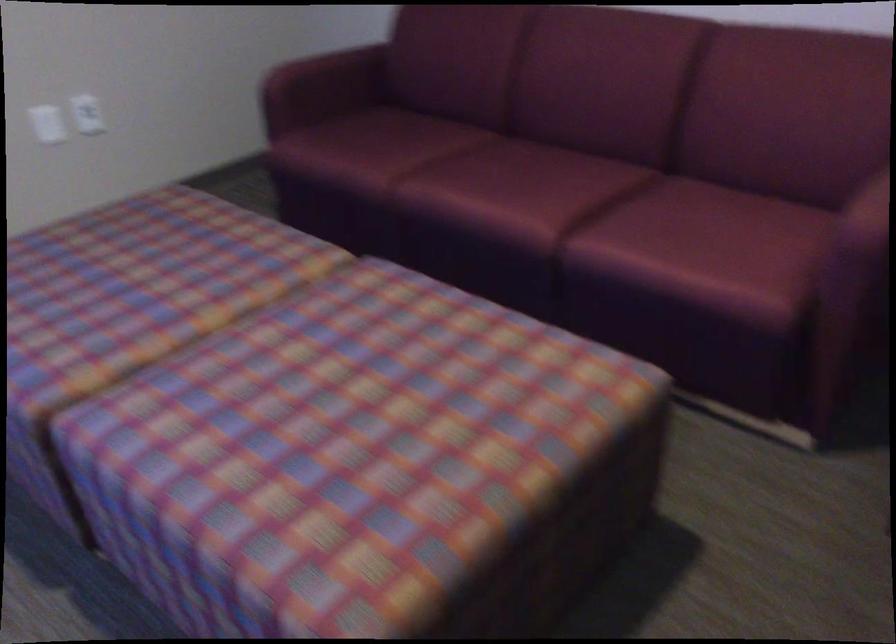
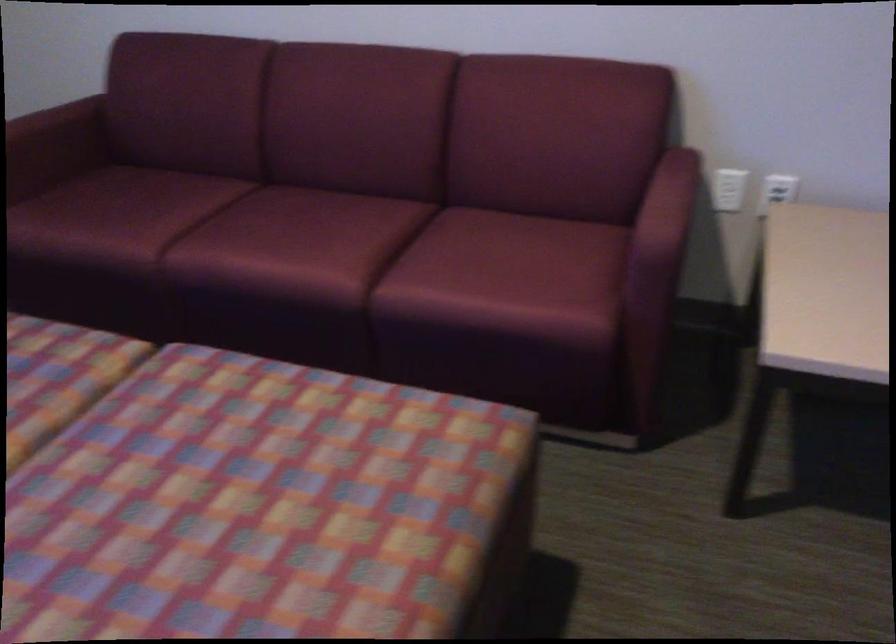
Locate, in the second image, the point that corresponds to (331,84) in the first image.

(55, 147)